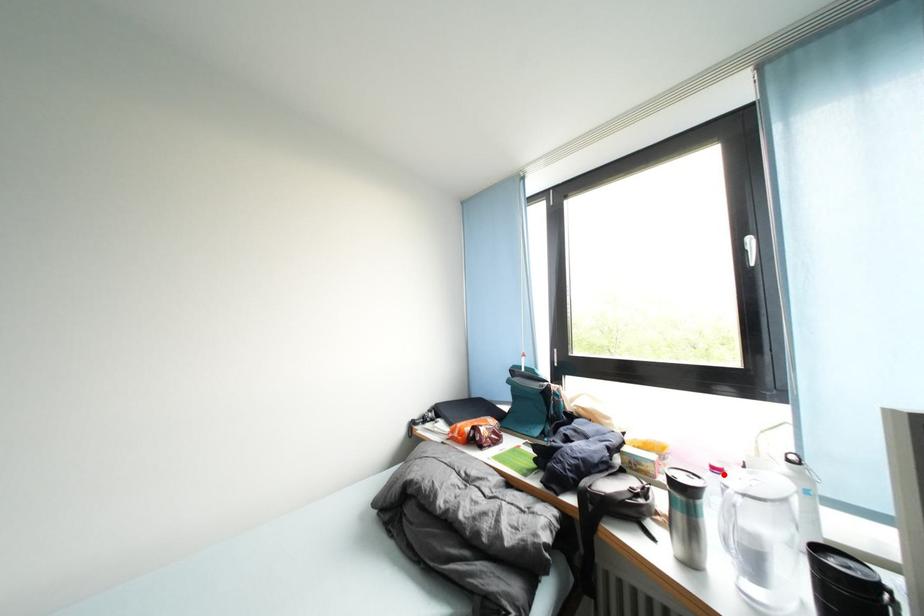
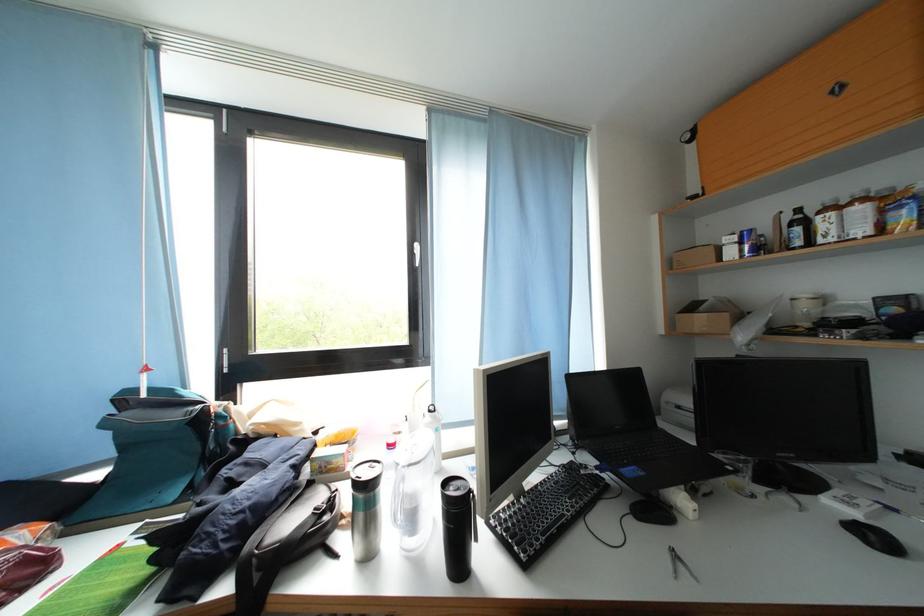
The point at the highlighted location is marked in the first image. Where is the corresponding point in the second image?

(398, 451)